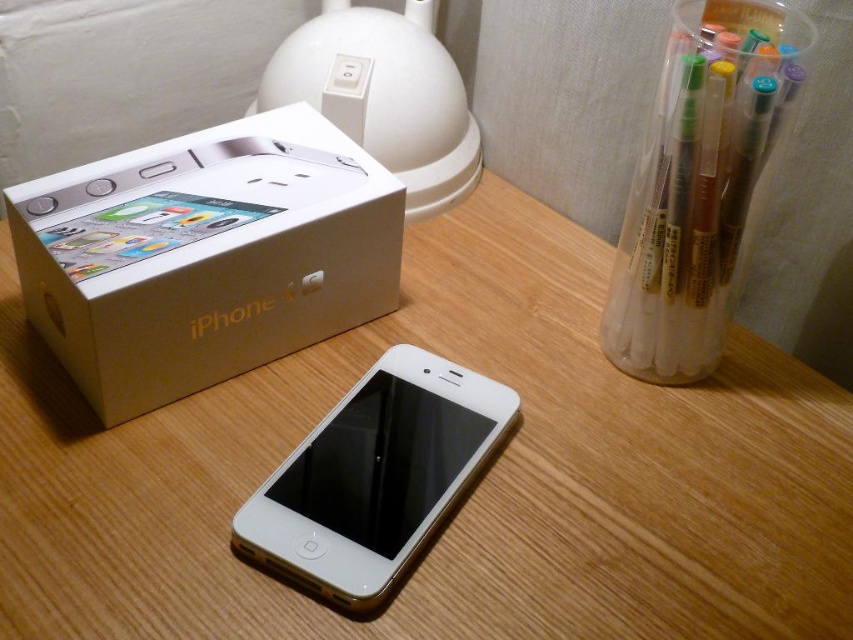
Question: Can you confirm if white cardboard iphone box at upper left is bigger than white glossy ipod at center?

Choices:
 (A) yes
 (B) no

Answer: (A)

Question: Can you confirm if wooden table at center is positioned below clear plastic pen at upper right?

Choices:
 (A) no
 (B) yes

Answer: (B)

Question: Can you confirm if white cardboard iphone box at upper left is thinner than white glossy ipod at center?

Choices:
 (A) yes
 (B) no

Answer: (B)

Question: Among these objects, which one is farthest from the camera?

Choices:
 (A) wooden table at center
 (B) white cardboard iphone box at upper left
 (C) white glossy ipod at center

Answer: (B)

Question: Among these points, which one is farthest from the camera?

Choices:
 (A) coord(631,198)
 (B) coord(189,204)

Answer: (A)

Question: Based on their relative distances, which object is farther from the wooden table at center?

Choices:
 (A) white glossy ipod at center
 (B) white cardboard iphone box at upper left

Answer: (B)